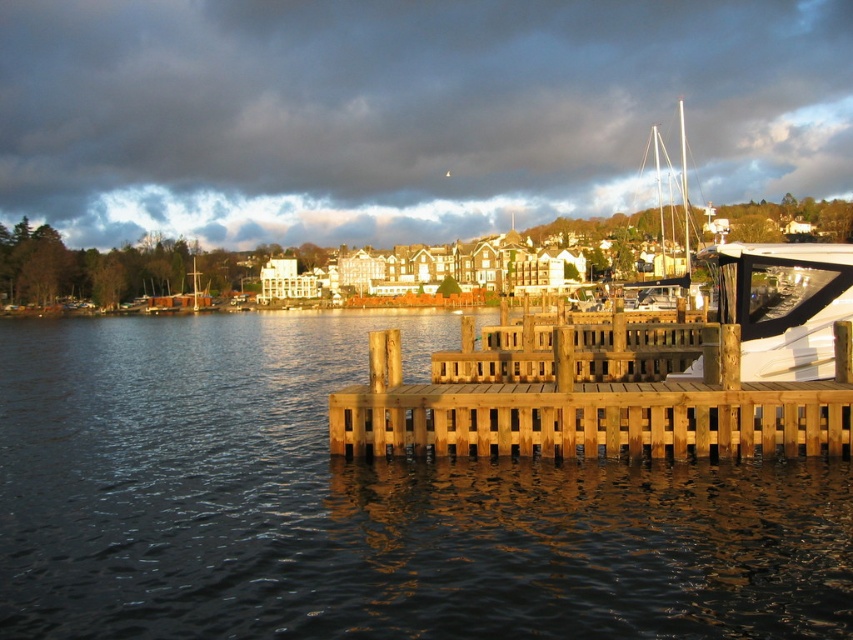
Does point (357, 534) come behind point (839, 432)?

No.

Locate an element on the screen. This screenshot has width=853, height=640. brown wooden dock at lower center is located at coordinates (363, 504).

Between point (430, 442) and point (798, 256), which one is positioned in front?

Point (430, 442) is in front.

Where is `wooden dock at lower center`? Image resolution: width=853 pixels, height=640 pixels. wooden dock at lower center is located at coordinates (593, 397).

Who is positioned more to the right, brown wooden dock at lower center or white matte boat at center?

white matte boat at center

Between brown wooden dock at lower center and white matte boat at center, which one appears on the left side from the viewer's perspective?

Positioned to the left is brown wooden dock at lower center.

The height and width of the screenshot is (640, 853). What do you see at coordinates (363, 504) in the screenshot?
I see `brown wooden dock at lower center` at bounding box center [363, 504].

The image size is (853, 640). What are the coordinates of `brown wooden dock at lower center` in the screenshot? It's located at (363, 504).